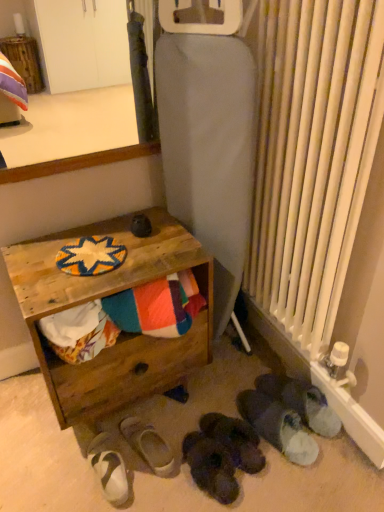
Image resolution: width=384 pixels, height=512 pixels. Identify the location of free spot to the right of dark gray suede slippers at lower center, the third footwear in the left-to-right sequence. (263, 486).